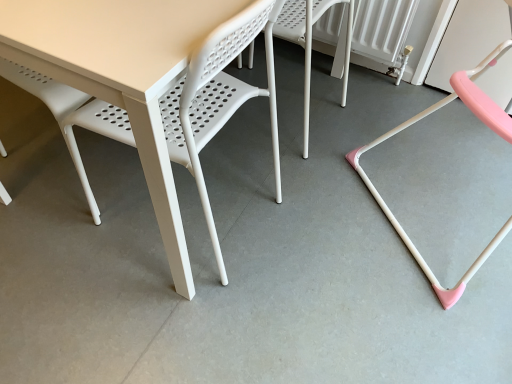
Locate an element on the screen. vacant location below white plastic table at center (from a real-world perspective) is located at coordinates (216, 218).